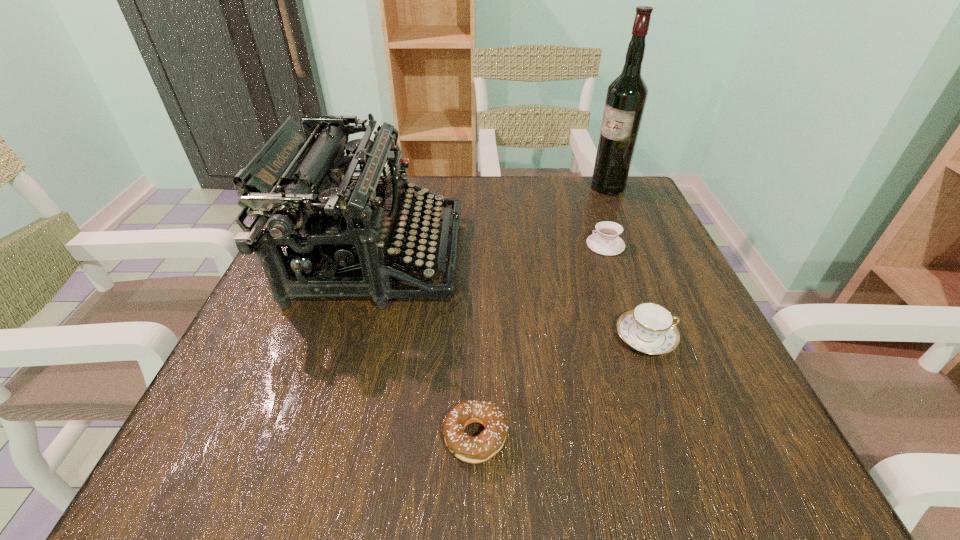
You are a GUI agent. You are given a task and a screenshot of the screen. Output one action in this format:
    pyautogui.click(x=<x>, y=<y>)
    Task: Click on the vacant space located 0.330m on the typing side of the typewriter
    The height and width of the screenshot is (540, 960).
    Given the screenshot: What is the action you would take?
    pyautogui.click(x=620, y=257)

Where is `free space located on the handle side of the farther teacup`? The image size is (960, 540). free space located on the handle side of the farther teacup is located at coordinates coord(440,245).

At what (x,y) coordinates should I click in order to perform the action: click on vacant position located on the handle side of the farther teacup. Please return your answer as a coordinate pair (x, y). This screenshot has height=540, width=960. Looking at the image, I should click on (540, 245).

This screenshot has height=540, width=960. I want to click on vacant space located on the handle side of the farther teacup, so click(x=416, y=245).

Locate an element on the screen. This screenshot has width=960, height=540. free region located on the back of the nearest object is located at coordinates (477, 270).

Identify the location of wine bottle that is at the far edge. (626, 97).

The height and width of the screenshot is (540, 960). I want to click on typewriter that is at the far edge, so click(x=300, y=180).

Identify the location of object that is at the near edge. This screenshot has width=960, height=540. (480, 448).

This screenshot has width=960, height=540. I want to click on object that is at the left edge, so click(300, 180).

What are the coordinates of `wine bottle situated at the right edge` in the screenshot? It's located at (626, 97).